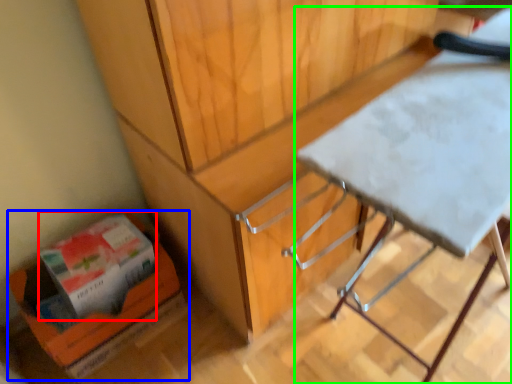
Question: Based on their relative distances, which object is farther from box (highlighted by a red box)? Choose from cardboard box (highlighted by a blue box) and table (highlighted by a green box).

Choices:
 (A) cardboard box
 (B) table

Answer: (B)